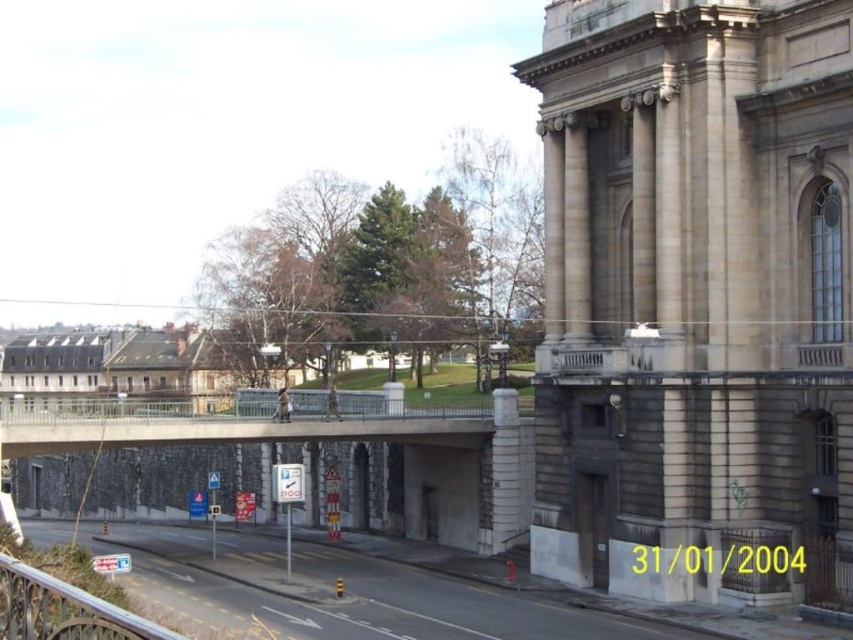
Question: Among these points, which one is farthest from the camera?

Choices:
 (A) (248, 428)
 (B) (39, 611)

Answer: (A)

Question: Is metallic gray bridge at center closer to the viewer compared to metallic silver railing at lower left?

Choices:
 (A) yes
 (B) no

Answer: (B)

Question: Is metallic gray bridge at center below metallic silver railing at lower left?

Choices:
 (A) yes
 (B) no

Answer: (B)

Question: Where is metallic gray bridge at center located in relation to metallic silver railing at lower left in the image?

Choices:
 (A) right
 (B) left

Answer: (B)